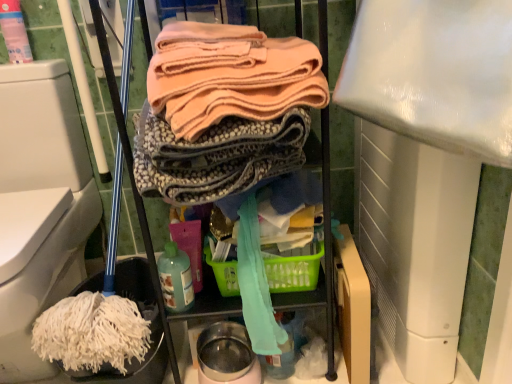
I want to click on white fabric mop head at lower left, so click(x=41, y=203).

Image resolution: width=512 pixels, height=384 pixels. What do you see at coordinates (175, 278) in the screenshot? I see `translucent plastic bottle at lower center` at bounding box center [175, 278].

What is the approximate width of green plastic basket at center?

12.27 inches.

The width and height of the screenshot is (512, 384). I want to click on white fabric mop head at lower left, so click(41, 203).

From a real-world perspective, is pink plastic spray bottle at upper left above or below white fabric mop head at lower left?

From a real-world perspective, pink plastic spray bottle at upper left is physically above white fabric mop head at lower left.

Does pink plastic spray bottle at upper left have a greater width compared to white fabric mop head at lower left?

In fact, pink plastic spray bottle at upper left might be narrower than white fabric mop head at lower left.

Considering the relative sizes of pink plastic spray bottle at upper left and white fabric mop head at lower left in the image provided, is pink plastic spray bottle at upper left shorter than white fabric mop head at lower left?

Yes.

Is pink plastic spray bottle at upper left beside white fabric mop head at lower left?

pink plastic spray bottle at upper left and white fabric mop head at lower left are not in contact.

Is translucent plastic bottle at lower center next to green plastic basket at center and touching it?

No, translucent plastic bottle at lower center is not touching green plastic basket at center.

From a real-world perspective, is translucent plastic bottle at lower center located beneath green plastic basket at center?

No, from a real-world perspective, translucent plastic bottle at lower center is not under green plastic basket at center.

Which object is further away from the camera, translucent plastic bottle at lower center or green plastic basket at center?

Positioned behind is green plastic basket at center.

Is white fabric mop head at lower left aimed at translucent plastic bottle at lower center?

No, white fabric mop head at lower left is not aimed at translucent plastic bottle at lower center.

Would you say white fabric mop head at lower left is to the left or to the right of translucent plastic bottle at lower center in the picture?

Clearly, white fabric mop head at lower left is on the left of translucent plastic bottle at lower center in the image.

The width and height of the screenshot is (512, 384). What are the coordinates of `bidet in front of the translucent plastic bottle at lower center` in the screenshot? It's located at (41, 203).

From a real-world perspective, is translucent plastic bottle at lower center over pink plastic spray bottle at upper left?

No, from a real-world perspective, translucent plastic bottle at lower center is not on top of pink plastic spray bottle at upper left.

Is there a large distance between translucent plastic bottle at lower center and pink plastic spray bottle at upper left?

translucent plastic bottle at lower center is actually quite close to pink plastic spray bottle at upper left.

Do you think translucent plastic bottle at lower center is within pink plastic spray bottle at upper left, or outside of it?

The correct answer is: outside.

Consider the image. Who is shorter, translucent plastic bottle at lower center or pink plastic spray bottle at upper left?

Standing shorter between the two is translucent plastic bottle at lower center.

Does point (66, 135) appear closer or farther from the camera than point (294, 267)?

Point (66, 135) appears to be farther away from the viewer than point (294, 267).

Locate an element on the screen. The image size is (512, 384). basket located below the white fabric mop head at lower left (from the image's perspective) is located at coordinates (x=294, y=271).

Considering the sizes of objects white fabric mop head at lower left and green plastic basket at center in the image provided, who is shorter, white fabric mop head at lower left or green plastic basket at center?

green plastic basket at center is shorter.

From a real-world perspective, does white fabric mop head at lower left stand above green plastic basket at center?

Indeed, from a real-world perspective, white fabric mop head at lower left stands above green plastic basket at center.

Which of these two, white fabric mop head at lower left or pink plastic spray bottle at upper left, is smaller?

pink plastic spray bottle at upper left is smaller.

From the picture: Is white fabric mop head at lower left spatially inside pink plastic spray bottle at upper left, or outside of it?

white fabric mop head at lower left lies outside pink plastic spray bottle at upper left.

Is point (24, 175) closer to camera compared to point (10, 43)?

No, (24, 175) is further to viewer.

Consider the image. Considering the sizes of objects pink plastic spray bottle at upper left and translucent plastic bottle at lower center in the image provided, who is shorter, pink plastic spray bottle at upper left or translucent plastic bottle at lower center?

With less height is translucent plastic bottle at lower center.

From the image's perspective, is pink plastic spray bottle at upper left above or below translucent plastic bottle at lower center?

Based on their image positions, pink plastic spray bottle at upper left is located above translucent plastic bottle at lower center.

Based on the photo, how different are the orientations of pink plastic spray bottle at upper left and translucent plastic bottle at lower center in degrees?

The angle between the facing direction of pink plastic spray bottle at upper left and the facing direction of translucent plastic bottle at lower center is 0.447 degrees.

Can you confirm if pink plastic spray bottle at upper left is thinner than translucent plastic bottle at lower center?

Correct, the width of pink plastic spray bottle at upper left is less than that of translucent plastic bottle at lower center.

Where is `bidet that appears on the left of pink plastic spray bottle at upper left`? This screenshot has height=384, width=512. bidet that appears on the left of pink plastic spray bottle at upper left is located at coordinates (41, 203).

What are the coordinates of `bottle in front of the green plastic basket at center` in the screenshot? It's located at (175, 278).

Looking at the image, which one is located further to translucent plastic bottle at lower center, pink plastic spray bottle at upper left or green plastic basket at center?

pink plastic spray bottle at upper left lies further to translucent plastic bottle at lower center than the other object.

Considering their positions, is green plastic basket at center positioned further to translucent plastic bottle at lower center than white fabric mop head at lower left?

white fabric mop head at lower left lies further to translucent plastic bottle at lower center than the other object.

Considering their positions, is translucent plastic bottle at lower center positioned further to green plastic basket at center than pink plastic spray bottle at upper left?

Based on the image, pink plastic spray bottle at upper left appears to be further to green plastic basket at center.

From the image, which object appears to be nearer to translucent plastic bottle at lower center, white fabric mop head at lower left or pink plastic spray bottle at upper left?

white fabric mop head at lower left.

Which object lies further to the anchor point pink plastic spray bottle at upper left, white fabric mop head at lower left or translucent plastic bottle at lower center?

translucent plastic bottle at lower center is further to pink plastic spray bottle at upper left.

Based on their spatial positions, is translucent plastic bottle at lower center or white fabric mop head at lower left further from pink plastic spray bottle at upper left?

translucent plastic bottle at lower center.

Looking at this image, based on their spatial positions, is white fabric mop head at lower left or translucent plastic bottle at lower center closer to green plastic basket at center?

Based on the image, translucent plastic bottle at lower center appears to be nearer to green plastic basket at center.

Based on the photo, when comparing their distances from pink plastic spray bottle at upper left, does translucent plastic bottle at lower center or green plastic basket at center seem further?

green plastic basket at center is positioned further to the anchor pink plastic spray bottle at upper left.

Find the location of a particular element. This screenshot has width=512, height=384. cleaning product located between white fabric mop head at lower left and green plastic basket at center in the left-right direction is located at coordinates (14, 32).

Where is `bottle between white fabric mop head at lower left and green plastic basket at center from left to right`? Image resolution: width=512 pixels, height=384 pixels. bottle between white fabric mop head at lower left and green plastic basket at center from left to right is located at coordinates (175, 278).

Find the location of a particular element. This screenshot has height=384, width=512. basket between pink plastic spray bottle at upper left and translucent plastic bottle at lower center in the vertical direction is located at coordinates (294, 271).

The height and width of the screenshot is (384, 512). Identify the location of bidet between pink plastic spray bottle at upper left and translucent plastic bottle at lower center from top to bottom. point(41,203).